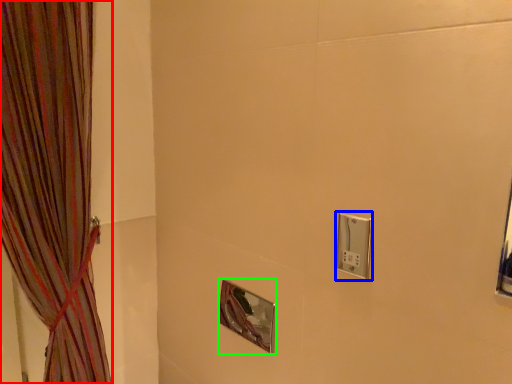
Question: Which object is positioned closest to curtain (highlighted by a red box)? Select from light switch (highlighted by a blue box) and mirror (highlighted by a green box).

Choices:
 (A) light switch
 (B) mirror

Answer: (B)